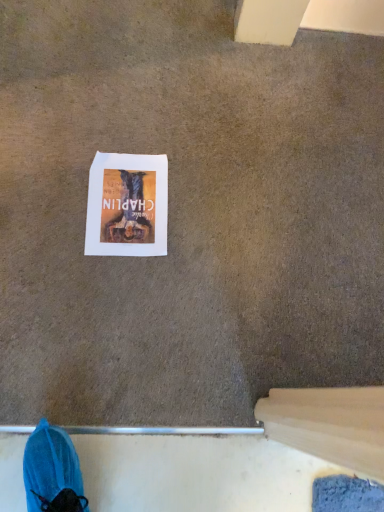
At what (x,y) coordinates should I click in order to perform the action: click on free space to the back side of white paper at center. Please return your answer as a coordinate pair (x, y). The width and height of the screenshot is (384, 512). Looking at the image, I should click on (152, 133).